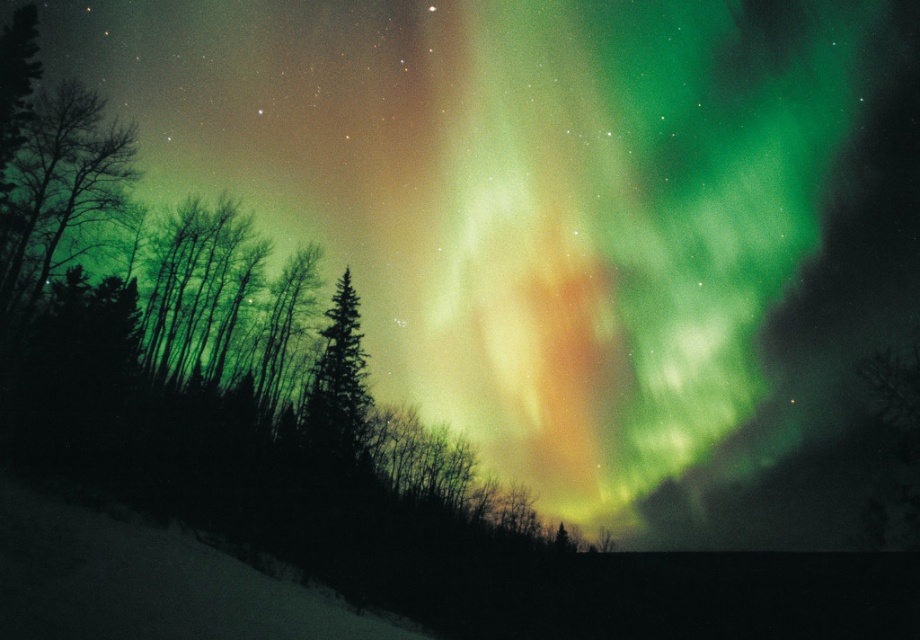
You are a photographer standing in the snowy field. You want to capture both the green matte tree at left and the green matte tree at center in a single wide shot. Given that your camera can capture a maximum horizontal distance of 25 meters in its widest setting, will you be able to include both trees in the frame?

The distance between the green matte tree at left and the green matte tree at center is 22.71 meters, which is less than the camera maximum horizontal distance of 25 meters. Yes, you can include both trees in the frame.

You are standing in the snowy field and want to take a photo of the green matte tree at left. Which direction should you face to ensure the tree is centered in your camera view?

The green matte tree at left is located at point 0.295 on the horizontal axis, so you should face towards the left side of the snowy field to center it in your camera view.